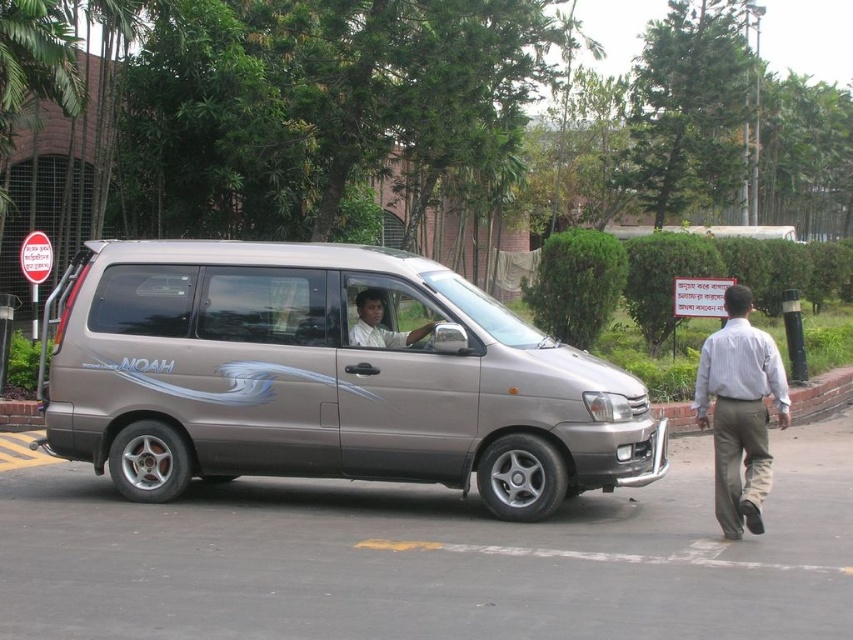
Is satin metallic van at center positioned in front of light brown shirt at center?

Yes, it is.

Where is `satin metallic van at center`? This screenshot has height=640, width=853. satin metallic van at center is located at coordinates (326, 378).

Describe the element at coordinates (326, 378) in the screenshot. I see `satin metallic van at center` at that location.

Between point (416, 376) and point (733, 401), which one is positioned behind?

The point (416, 376) is behind.

Locate an element on the screen. satin metallic van at center is located at coordinates (326, 378).

Between light gray shirt at center and light brown shirt at center, which one is positioned lower?

Positioned lower is light gray shirt at center.

Can you confirm if light gray shirt at center is smaller than light brown shirt at center?

Incorrect, light gray shirt at center is not smaller in size than light brown shirt at center.

You are a GUI agent. You are given a task and a screenshot of the screen. Output one action in this format:
    pyautogui.click(x=<x>, y=<y>)
    Task: Click on the light gray shirt at center
    The height and width of the screenshot is (640, 853).
    Given the screenshot: What is the action you would take?
    pyautogui.click(x=740, y=412)

At what (x,y) coordinates should I click in order to perform the action: click on light gray shirt at center. Please return your answer as a coordinate pair (x, y). This screenshot has height=640, width=853. Looking at the image, I should click on pyautogui.click(x=740, y=412).